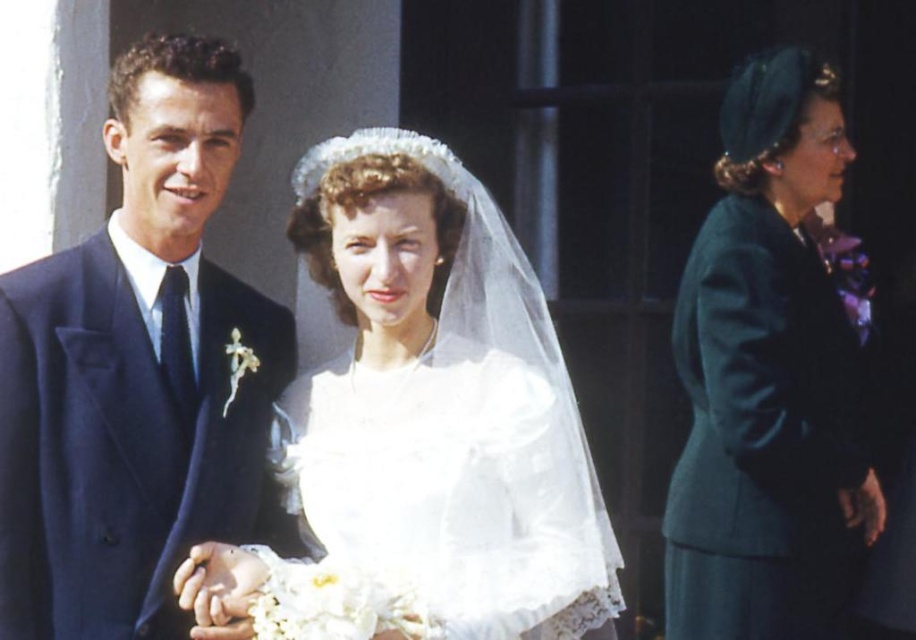
You are a photographer preparing to take a group photo of the white satin dress at center and the navy blue suit at left. Which clothing item should you focus on first to ensure proper exposure, considering their sizes?

The white satin dress at center has a larger size compared to the navy blue suit at left, so you should focus on the white satin dress at center first to ensure proper exposure due to its larger surface area.